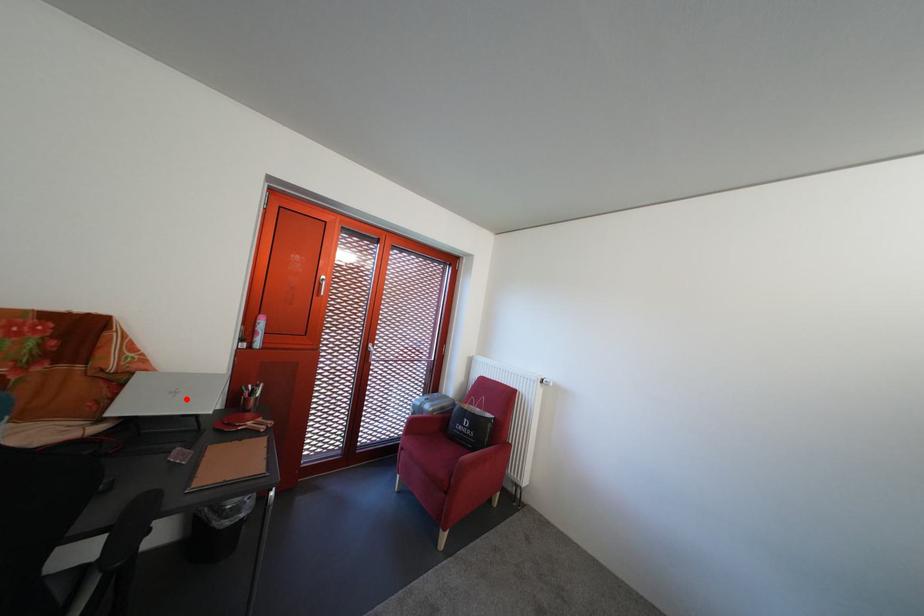
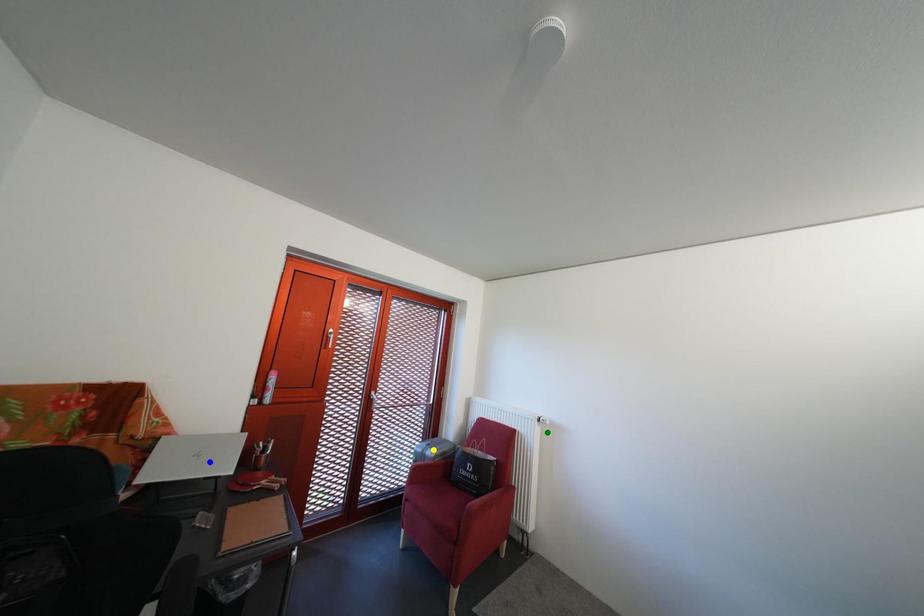
Question: I am providing you with two images of the same scene from different viewpoints. A red point is marked on the first image. You are given multiple points on the second image. Which spot in image 2 lines up with the point in image 1?

Choices:
 (A) blue point
 (B) yellow point
 (C) green point

Answer: (A)